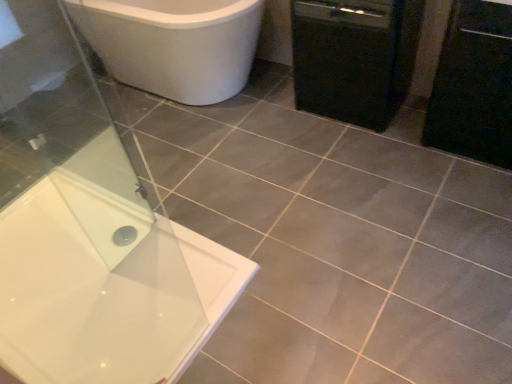
Question: Is black matte dishwasher at right inside or outside of transparent glass screen door at lower left?

Choices:
 (A) inside
 (B) outside

Answer: (B)

Question: Looking at the image, does black matte dishwasher at right seem bigger or smaller compared to transparent glass screen door at lower left?

Choices:
 (A) big
 (B) small

Answer: (A)

Question: Which object is the closest to the transparent glass screen door at lower left?

Choices:
 (A) white glossy bathtub at upper left
 (B) black matte dishwasher at right
 (C) black matte cabinet at right

Answer: (A)

Question: Which object is the closest to the black matte dishwasher at right?

Choices:
 (A) white glossy bathtub at upper left
 (B) transparent glass screen door at lower left
 (C) black matte cabinet at right

Answer: (C)